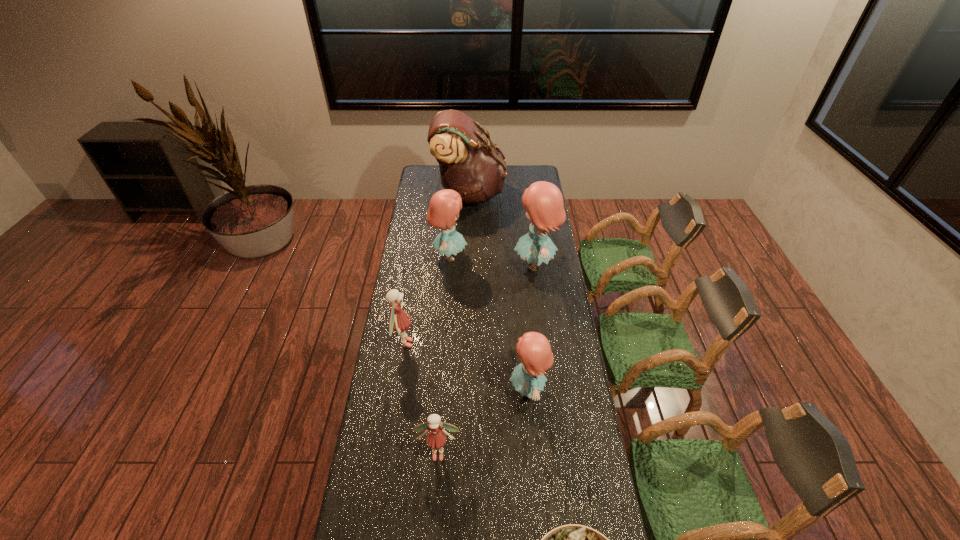
Choose which object is the second nearest neighbor to the nearest blue doll. Please provide its 2D coordinates. Your answer should be formatted as a tuple, i.e. [(x, y)], where the tuple contains the x and y coordinates of a point satisfying the conditions above.

[(543, 201)]

Identify which doll is the fourth nearest to the shortest doll. Please provide its 2D coordinates. Your answer should be formatted as a tuple, i.e. [(x, y)], where the tuple contains the x and y coordinates of a point satisfying the conditions above.

[(444, 207)]

This screenshot has width=960, height=540. I want to click on doll that is the third nearest to the salad, so click(x=399, y=321).

Identify which blue doll is the second closest to the biggest blue doll. Please provide its 2D coordinates. Your answer should be formatted as a tuple, i.e. [(x, y)], where the tuple contains the x and y coordinates of a point satisfying the conditions above.

[(534, 351)]

Identify which blue doll is the second closest to the tallest doll. Please provide its 2D coordinates. Your answer should be formatted as a tuple, i.e. [(x, y)], where the tuple contains the x and y coordinates of a point satisfying the conditions above.

[(534, 351)]

At what (x,y) coordinates should I click in order to perform the action: click on vacant space that satisfies the following two spatial constraints: 1. on the front-facing side of the nearest blue doll; 2. on the front-facing side of the nearest doll. Please return your answer as a coordinate pair (x, y). This screenshot has width=960, height=540. Looking at the image, I should click on (534, 453).